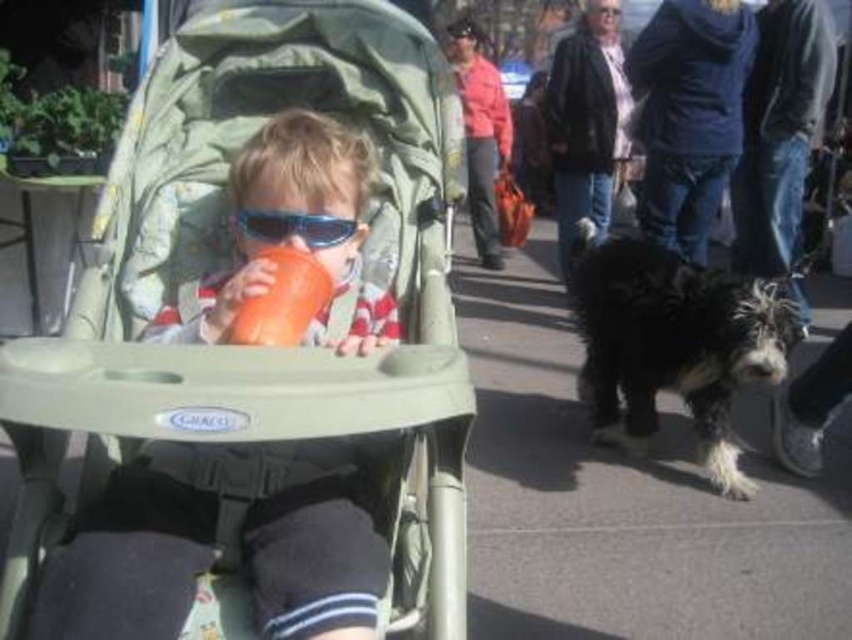
Question: Which of the following is the farthest from the observer?

Choices:
 (A) matte green stroller at center
 (B) black shaggy dog at right
 (C) orange matte cup at center
 (D) blue plastic goggles at center

Answer: (B)

Question: In this image, where is black shaggy dog at right located relative to blue plastic goggles at center?

Choices:
 (A) left
 (B) right

Answer: (B)

Question: Is matte green stroller at center bigger than orange matte cup at center?

Choices:
 (A) no
 (B) yes

Answer: (B)

Question: Which of the following is the farthest from the observer?

Choices:
 (A) orange matte cup at center
 (B) black shaggy dog at right
 (C) blue plastic goggles at center
 (D) matte green stroller at center

Answer: (B)

Question: Can you confirm if orange matte cup at center is smaller than blue plastic goggles at center?

Choices:
 (A) yes
 (B) no

Answer: (B)

Question: Which point is closer to the camera taking this photo?

Choices:
 (A) (297, 214)
 (B) (707, 268)
 (C) (219, 129)

Answer: (A)